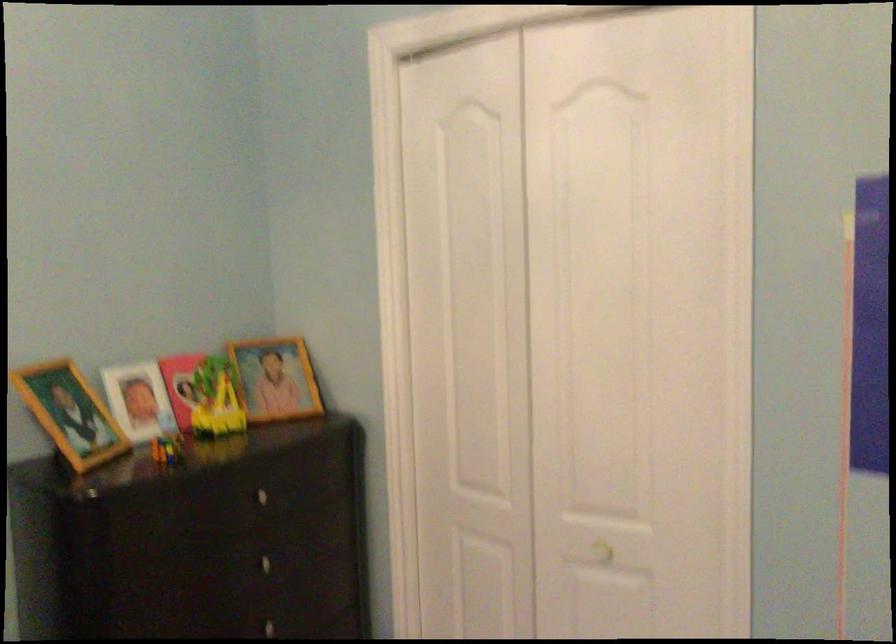
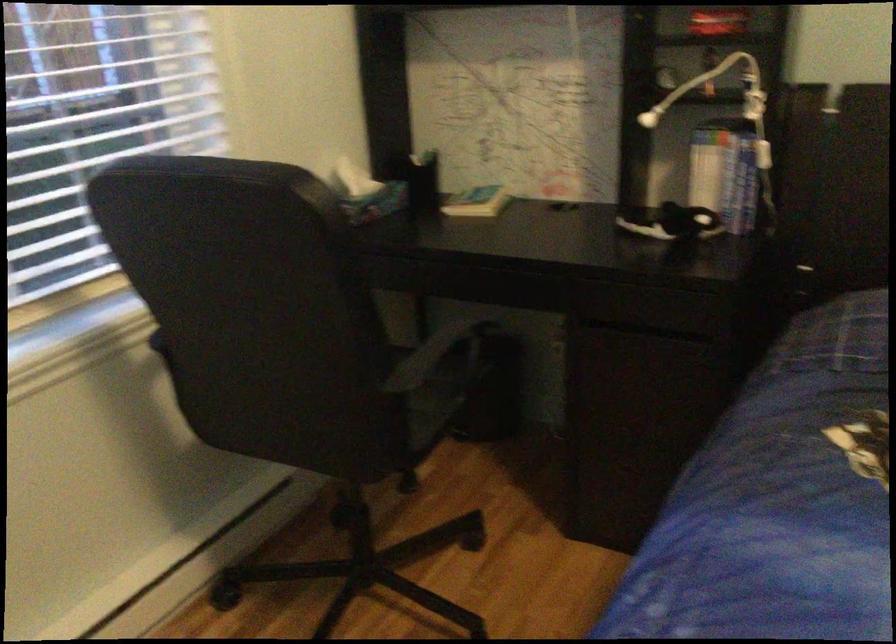
First-person continuous shooting, in which direction is the camera rotating?

The camera's rotation is toward left-down.